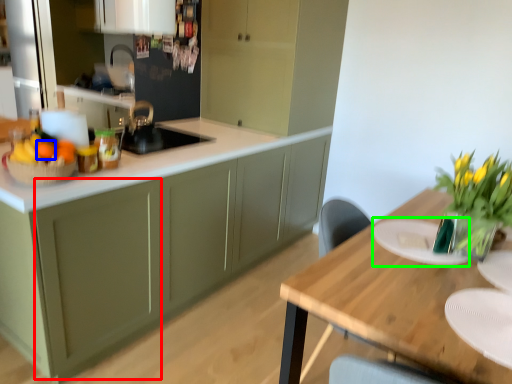
Question: Which object is the farthest from cabinetry (highlighted by a red box)? Choose among these: tangerine (highlighted by a blue box) or plate (highlighted by a green box).

Choices:
 (A) tangerine
 (B) plate

Answer: (B)